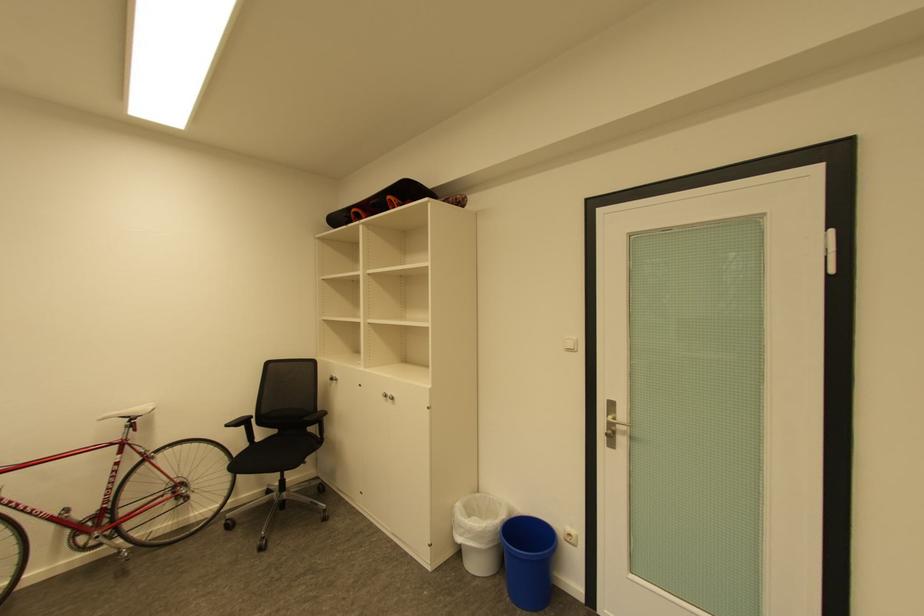
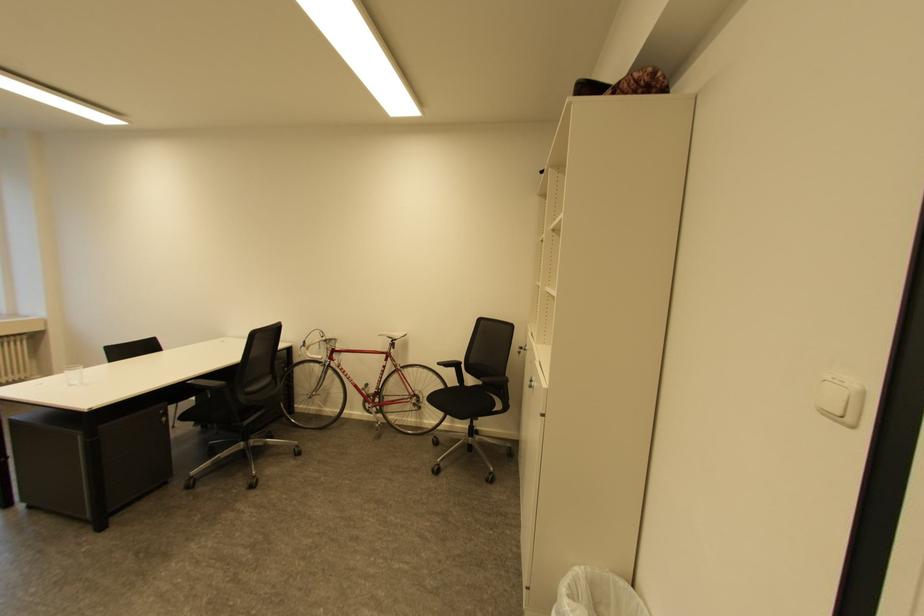
Question: I am providing you with two images of the same scene from different viewpoints. Which of the following objects are not visible in image2?

Choices:
 (A) black chair sitting surface
 (B) white bicycle saddle
 (C) clear drinking glass
 (D) none of these

Answer: (D)